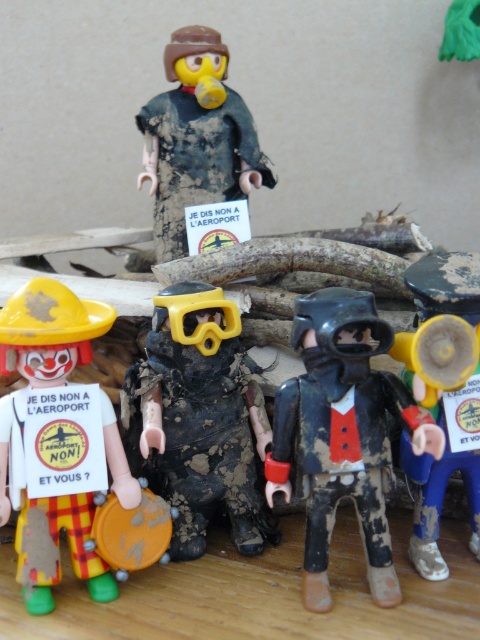
You are organizing a protest and need to place the matte black diving suit at center and the yellow matte megaphone at right in a way that the diving suit is visible to the crowd behind the megaphone. Can you position them so the diving suit is not blocked by the megaphone?

The matte black diving suit at center is located below the yellow matte megaphone at right, so positioning them with the diving suit below the megaphone would mean the megaphone is above it. This arrangement would block the view of the diving suit from behind, so it would not be visible to the crowd. To ensure visibility, the diving suit should be placed above the megaphone instead.

You are organizing a protest and need to decide which object to use as a sign holder. The matte black diving suit at center and the matte yellow hat at left are available. Which object is bigger and thus more suitable for holding a larger sign?

The matte black diving suit at center is larger in size than the matte yellow hat at left, so it is more suitable for holding a larger sign.